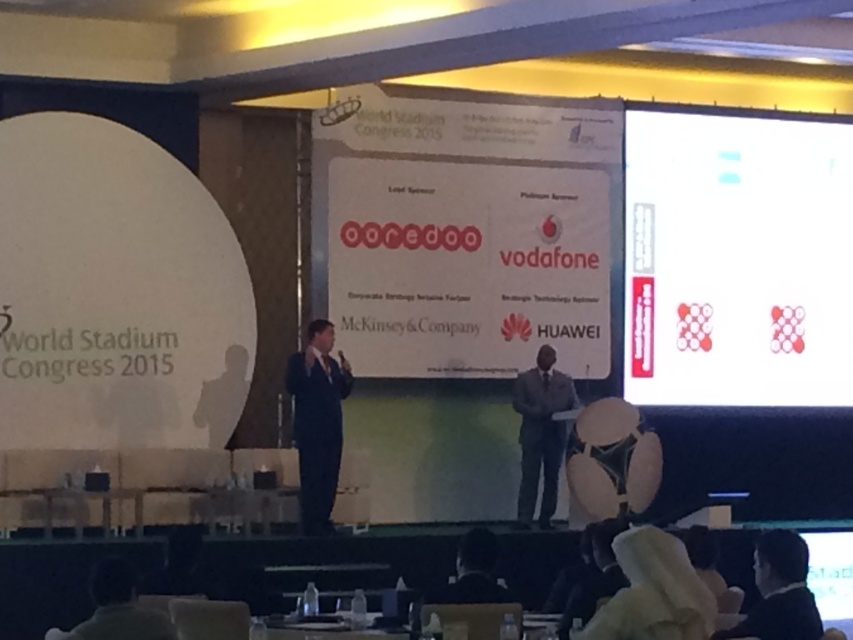
Which is more to the left, black suit at center or black suit at lower right?

Positioned to the left is black suit at center.

Does black suit at center appear over black suit at lower right?

Correct, black suit at center is located above black suit at lower right.

Describe the element at coordinates (317, 422) in the screenshot. I see `black suit at center` at that location.

You are a GUI agent. You are given a task and a screenshot of the screen. Output one action in this format:
    pyautogui.click(x=<x>, y=<y>)
    Task: Click on the black suit at center
    
    Given the screenshot: What is the action you would take?
    pyautogui.click(x=317, y=422)

Between white paper at upper right and black suit at lower right, which one is positioned lower?

black suit at lower right

Which is behind, point (838, 349) or point (759, 598)?

The point (838, 349) is behind.

Identify the location of white paper at upper right. The width and height of the screenshot is (853, 640). (737, 257).

In the scene shown: Between white paper at upper right and black suit at center, which one is positioned higher?

white paper at upper right is above.

Can you confirm if white paper at upper right is wider than black suit at center?

Yes.

What do you see at coordinates (737, 257) in the screenshot?
I see `white paper at upper right` at bounding box center [737, 257].

Locate an element on the screen. The image size is (853, 640). white paper at upper right is located at coordinates (737, 257).